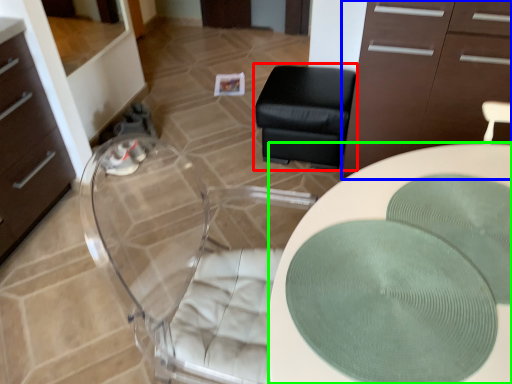
Question: Which object is the farthest from furniture (highlighted by a red box)? Choose among these: cabinetry (highlighted by a blue box) or desk (highlighted by a green box).

Choices:
 (A) cabinetry
 (B) desk

Answer: (B)